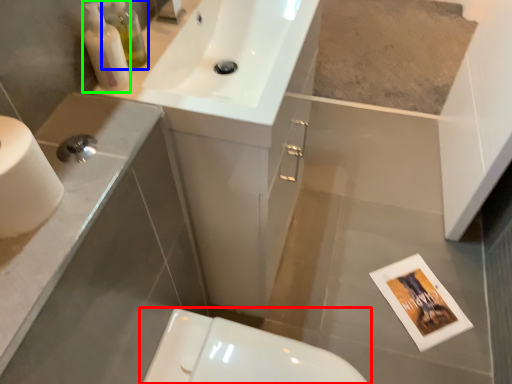
Question: Based on their relative distances, which object is nearer to toilet (highlighted by a red box)? Choose from toiletry (highlighted by a blue box) and soap dispenser (highlighted by a green box).

Choices:
 (A) toiletry
 (B) soap dispenser

Answer: (B)